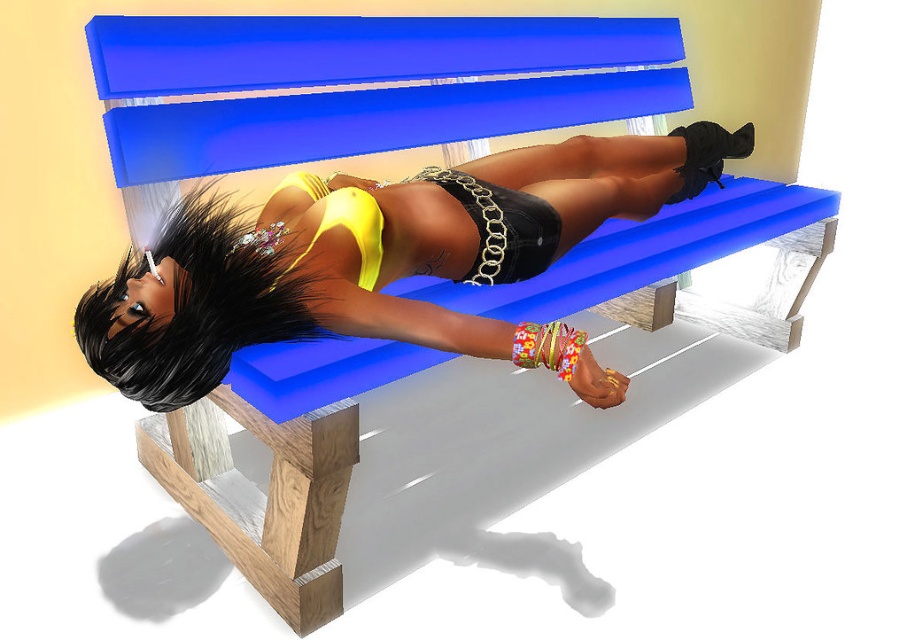
Is point (528, 205) in front of point (336, 195)?

No, (528, 205) is further to viewer.

Which is in front, point (322, 324) or point (325, 192)?

Positioned in front is point (322, 324).

Find the location of `matte yellow bikini top at center`. matte yellow bikini top at center is located at coordinates (372, 256).

Does matte yellow bikini top at center have a larger size compared to floral fabric underwear at lower center?

Yes, matte yellow bikini top at center is bigger than floral fabric underwear at lower center.

Is matte yellow bikini top at center positioned in front of floral fabric underwear at lower center?

Yes.

Find the location of a particular element. The height and width of the screenshot is (640, 907). matte yellow bikini top at center is located at coordinates (372, 256).

Which of these two, yellow satin bikini top at center or floral fabric underwear at lower center, stands shorter?

floral fabric underwear at lower center

Which is in front, point (335, 211) or point (569, 365)?

Point (569, 365)

Find the location of a particular element. The height and width of the screenshot is (640, 907). yellow satin bikini top at center is located at coordinates (345, 218).